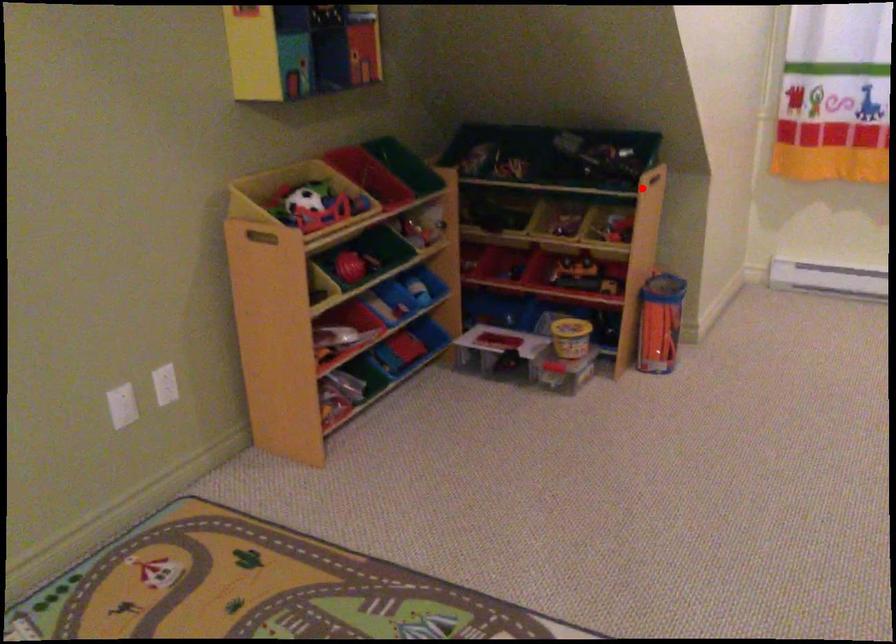
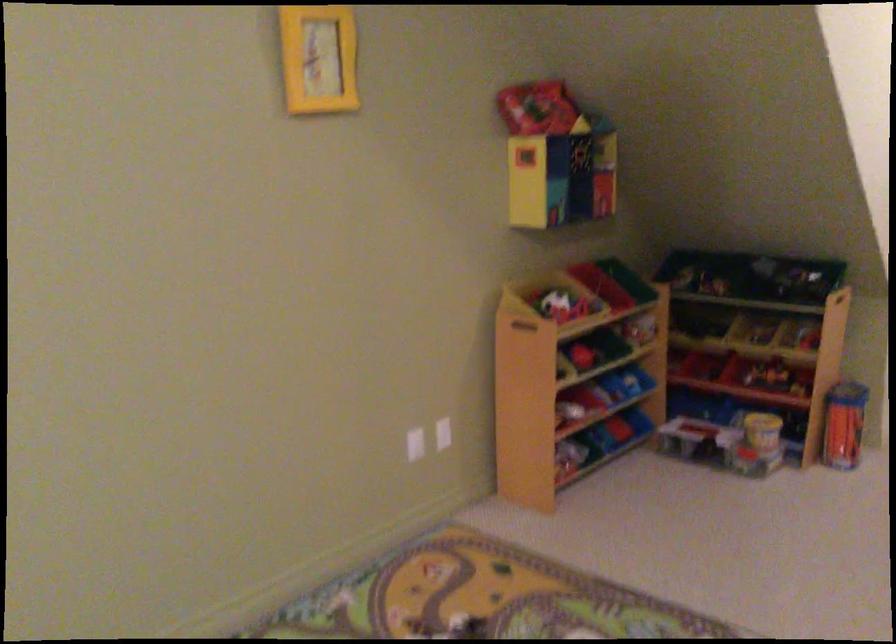
Find the pixel in the second image that matches the highlighted location in the first image.

(839, 303)